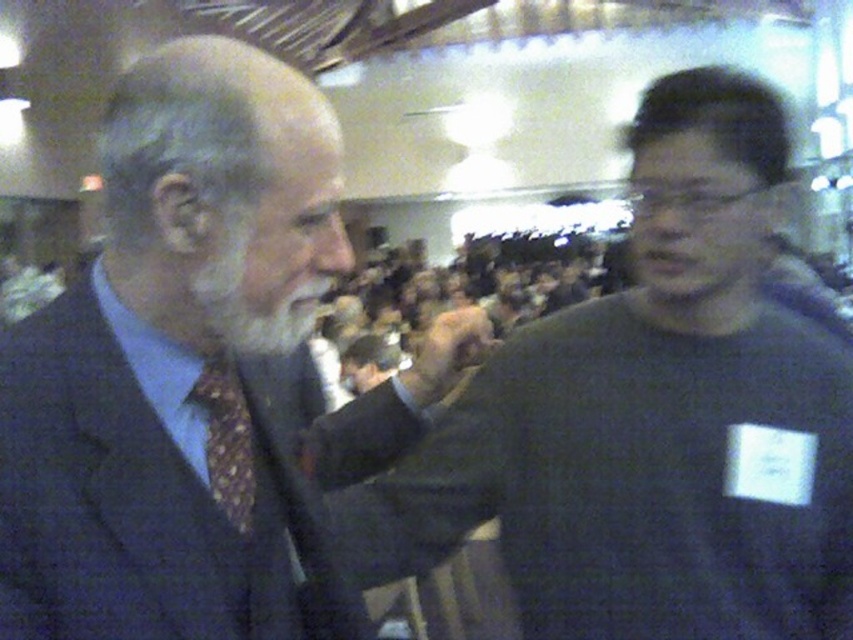
Between dark gray sweater at right and patterned silk tie at left, which one appears on the right side from the viewer's perspective?

From the viewer's perspective, dark gray sweater at right appears more on the right side.

Is the position of dark gray sweater at right more distant than that of patterned silk tie at left?

Yes, dark gray sweater at right is further from the viewer.

Where is `dark gray sweater at right`? This screenshot has height=640, width=853. dark gray sweater at right is located at coordinates (653, 419).

Which is in front, point (264, 342) or point (425, 394)?

Point (264, 342) is in front.

Is white matte beard at left wider than matte black hand at center?

No.

Does point (273, 264) come behind point (453, 314)?

No, (273, 264) is in front of (453, 314).

Image resolution: width=853 pixels, height=640 pixels. I want to click on white matte beard at left, so click(253, 292).

Does dark blue suit at left appear under dark gray sweater at right?

Incorrect, dark blue suit at left is not positioned below dark gray sweater at right.

Does dark blue suit at left have a smaller size compared to dark gray sweater at right?

Indeed, dark blue suit at left has a smaller size compared to dark gray sweater at right.

Between point (225, 563) and point (759, 449), which one is positioned behind?

Positioned behind is point (759, 449).

Where is `dark blue suit at left`? dark blue suit at left is located at coordinates (190, 376).